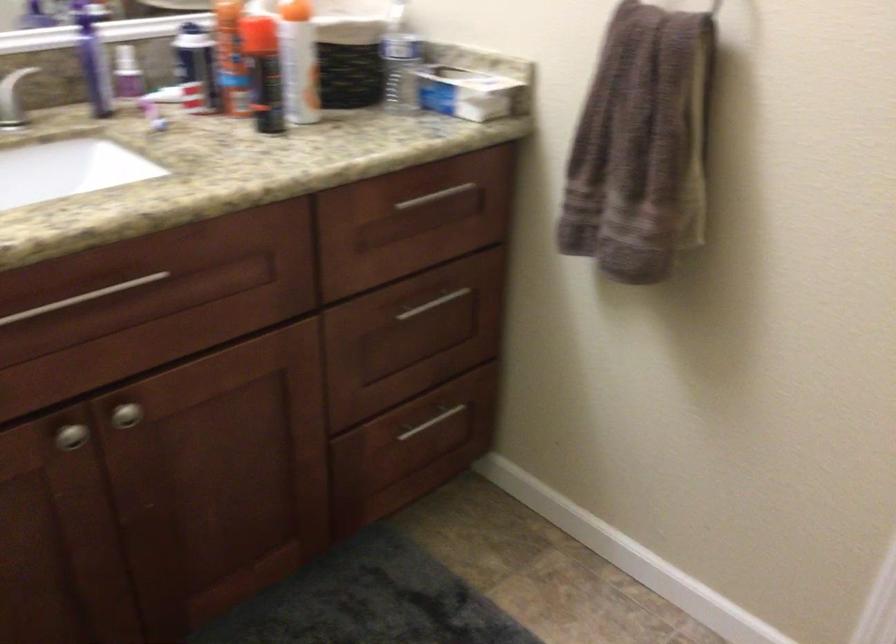
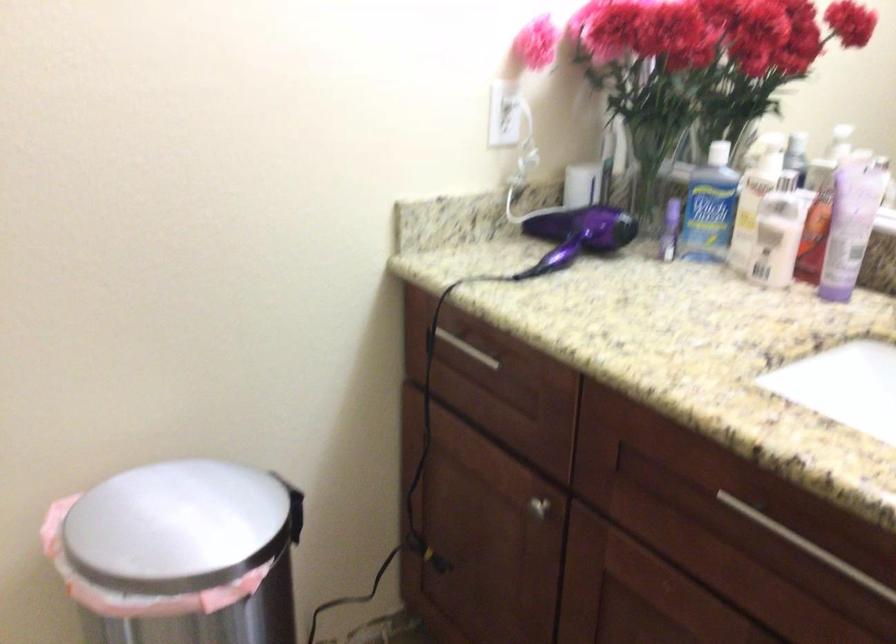
Based on the photo, based on the continuous images, in which direction is the camera rotating?

The camera rotated toward left-down.